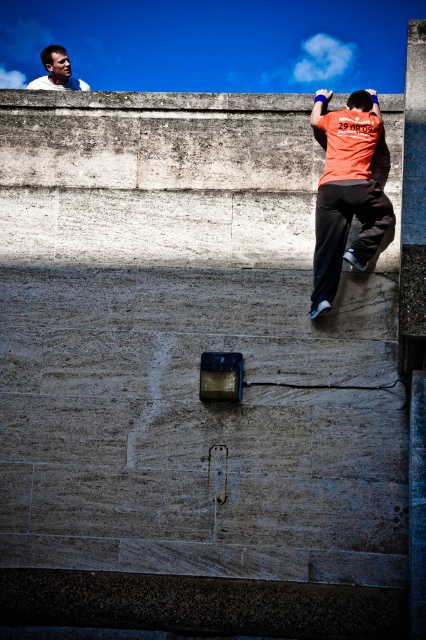
You are a photographer trying to capture both the orange matte shirt at upper right and the white shirt at upper left in a single frame. Based on their positions, which one is closer to the right edge of your camera view?

The orange matte shirt at upper right is positioned on the right side of white shirt at upper left, so it is closer to the right edge of the camera view.

Based on the coordinates provided, where exactly is the orange matte shirt at upper right located in the image?

The orange matte shirt at upper right is located at point coordinates of 0.302 on the x axis and 0.815 on the y axis.

From the picture: You are a photographer trying to capture both the orange matte shirt at upper right and the white shirt at upper left in a single frame. Given their sizes, which shirt will appear closer to the camera in the photo?

The orange matte shirt at upper right is smaller than the white shirt at upper left. In photography, objects that are smaller in the frame typically appear farther away from the camera. Therefore, the white shirt at upper left, being larger, will appear closer to the camera in the photo.